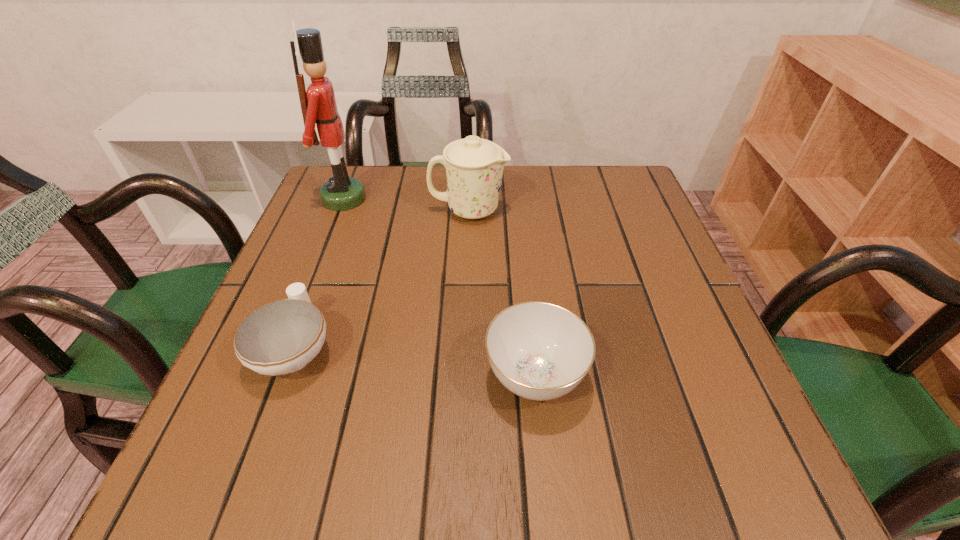
Find the location of a particular element. Image resolution: width=960 pixels, height=540 pixels. vacant point at the far left corner is located at coordinates (375, 167).

Identify the location of vacant space at the far right corner of the desktop. (585, 197).

The height and width of the screenshot is (540, 960). I want to click on vacant area between the nutcracker and the second tallest chinaware, so click(440, 287).

The image size is (960, 540). Identify the location of vacant area between the tallest object and the second shortest chinaware. (440, 287).

Image resolution: width=960 pixels, height=540 pixels. In order to click on free space between the second tallest object and the third tallest object in this screenshot , I will do `click(502, 293)`.

The height and width of the screenshot is (540, 960). Identify the location of vacant region between the nutcracker and the farthest chinaware. (406, 205).

The image size is (960, 540). I want to click on empty space between the second tallest object and the leftmost chinaware, so click(x=382, y=280).

Identify the location of vacant area that lies between the third shortest object and the tallest object. (406, 205).

Where is `free space that is in between the second shortest object and the leftmost chinaware`? The width and height of the screenshot is (960, 540). free space that is in between the second shortest object and the leftmost chinaware is located at coordinates (415, 362).

What are the coordinates of `vacant point located between the second tallest object and the second tallest chinaware` in the screenshot? It's located at (502, 293).